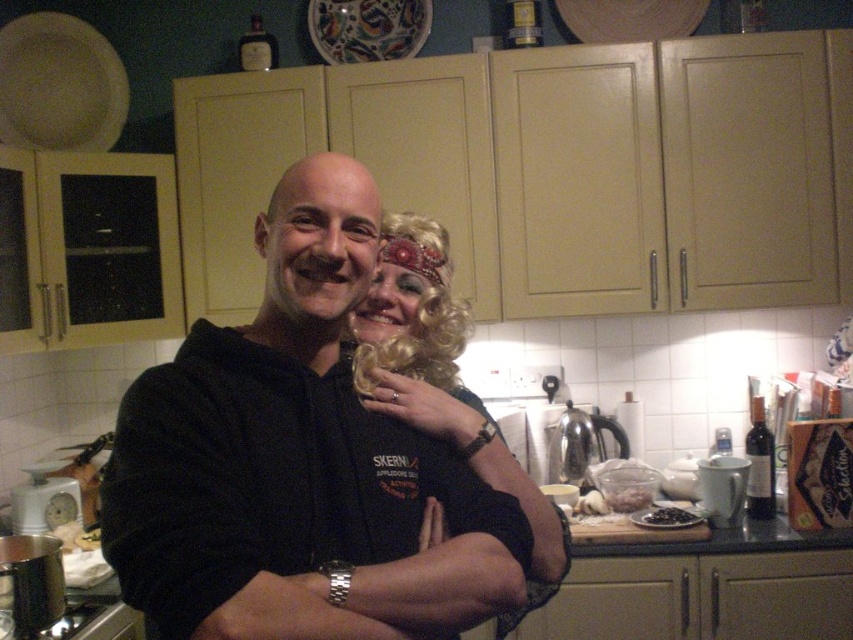
Question: Can you confirm if blonde curly wig at center is positioned to the left of black fabric arm at center?

Choices:
 (A) no
 (B) yes

Answer: (B)

Question: Can you confirm if black matte hoodie at center is bigger than black fabric arm at center?

Choices:
 (A) no
 (B) yes

Answer: (B)

Question: Which is nearer to the black fabric arm at center?

Choices:
 (A) blonde curly wig at center
 (B) black matte hoodie at center

Answer: (A)

Question: Which of these objects is positioned farthest from the black matte hoodie at center?

Choices:
 (A) blonde curly wig at center
 (B) black fabric arm at center

Answer: (A)

Question: Among these points, which one is nearest to the camera?

Choices:
 (A) (294, 230)
 (B) (402, 227)
 (C) (360, 397)

Answer: (A)

Question: Is blonde curly wig at center wider than black fabric arm at center?

Choices:
 (A) yes
 (B) no

Answer: (B)